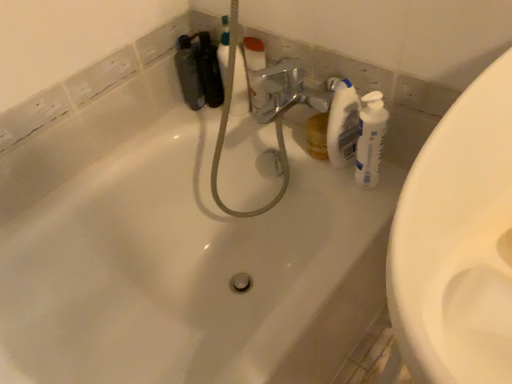
Question: From a real-world perspective, is translucent plastic bottle at upper right, acting as the 2th cleaning product starting from the right, above or below white plastic bottle at right, placed as the second cleaning product when sorted from left to right?

Choices:
 (A) below
 (B) above

Answer: (B)

Question: Which is correct: translucent plastic bottle at upper right, acting as the first cleaning product starting from the left, is inside white plastic bottle at right, placed as the second cleaning product when sorted from left to right, or outside of it?

Choices:
 (A) inside
 (B) outside

Answer: (B)

Question: Which object is positioned closest to the matte black bottle at upper left?

Choices:
 (A) white plastic bottle at right, placed as the second cleaning product when sorted from left to right
 (B) white glossy bathtub at center
 (C) translucent plastic bottle at upper right, acting as the 2th cleaning product starting from the right

Answer: (B)

Question: Based on their relative distances, which object is farther from the white plastic bottle at right, placed as the second cleaning product when sorted from left to right?

Choices:
 (A) translucent plastic bottle at upper right, acting as the 2th cleaning product starting from the right
 (B) white glossy bathtub at center
 (C) matte black bottle at upper left

Answer: (C)